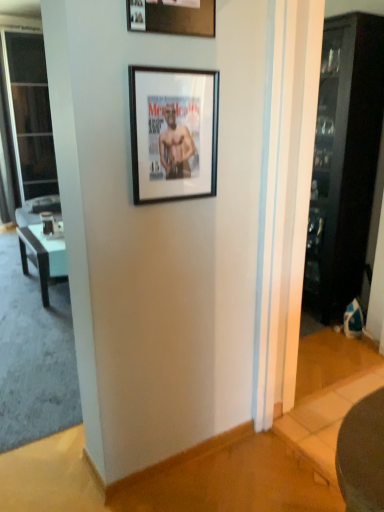
Question: Is the surface of wooden picture frame at upper center, which ranks as the 1th picture frame in top-to-bottom order, in direct contact with black glossy table at left?

Choices:
 (A) yes
 (B) no

Answer: (B)

Question: Can black glossy table at left be found inside wooden picture frame at upper center, which ranks as the 1th picture frame in top-to-bottom order?

Choices:
 (A) no
 (B) yes

Answer: (A)

Question: Is wooden picture frame at upper center, which ranks as the 1th picture frame in top-to-bottom order, located outside black glossy table at left?

Choices:
 (A) no
 (B) yes

Answer: (B)

Question: Is wooden picture frame at upper center, positioned as the 2th picture frame in bottom-to-top order, facing away from black glossy table at left?

Choices:
 (A) yes
 (B) no

Answer: (B)

Question: Does wooden picture frame at upper center, which ranks as the 1th picture frame in top-to-bottom order, have a smaller size compared to black glossy table at left?

Choices:
 (A) no
 (B) yes

Answer: (B)

Question: From the image's perspective, is black glossy table at left above or below wooden picture frame at upper center, positioned as the 2th picture frame in bottom-to-top order?

Choices:
 (A) above
 (B) below

Answer: (B)

Question: Looking at their shapes, would you say black glossy table at left is wider or thinner than wooden picture frame at upper center, positioned as the 2th picture frame in bottom-to-top order?

Choices:
 (A) thin
 (B) wide

Answer: (B)

Question: Is black glossy table at left inside or outside of wooden picture frame at upper center, which ranks as the 1th picture frame in top-to-bottom order?

Choices:
 (A) inside
 (B) outside

Answer: (B)

Question: Based on their positions, is black glossy table at left located to the left or right of wooden picture frame at upper center, positioned as the 2th picture frame in bottom-to-top order?

Choices:
 (A) right
 (B) left

Answer: (B)

Question: From the image's perspective, is dark wood cabinet at right above or below black matte picture frame at upper center, marked as the first picture frame in a bottom-to-top arrangement?

Choices:
 (A) below
 (B) above

Answer: (B)

Question: Considering the positions of dark wood cabinet at right and black matte picture frame at upper center, which is the 2th picture frame from top to bottom, in the image, is dark wood cabinet at right wider or thinner than black matte picture frame at upper center, which is the 2th picture frame from top to bottom,?

Choices:
 (A) wide
 (B) thin

Answer: (A)

Question: Relative to black matte picture frame at upper center, marked as the first picture frame in a bottom-to-top arrangement, is dark wood cabinet at right in front or behind?

Choices:
 (A) behind
 (B) front

Answer: (A)

Question: Looking at the image, does dark wood cabinet at right seem bigger or smaller compared to black matte picture frame at upper center, marked as the first picture frame in a bottom-to-top arrangement?

Choices:
 (A) small
 (B) big

Answer: (B)

Question: From the image's perspective, is transparent glass screen door at left positioned above or below black glossy table at left?

Choices:
 (A) below
 (B) above

Answer: (B)

Question: In terms of height, does transparent glass screen door at left look taller or shorter compared to black glossy table at left?

Choices:
 (A) short
 (B) tall

Answer: (B)